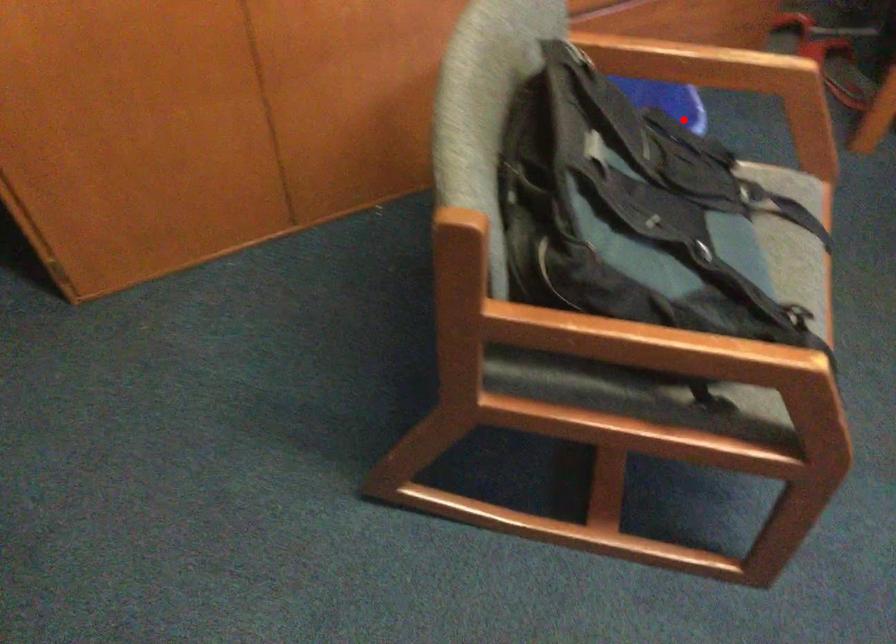
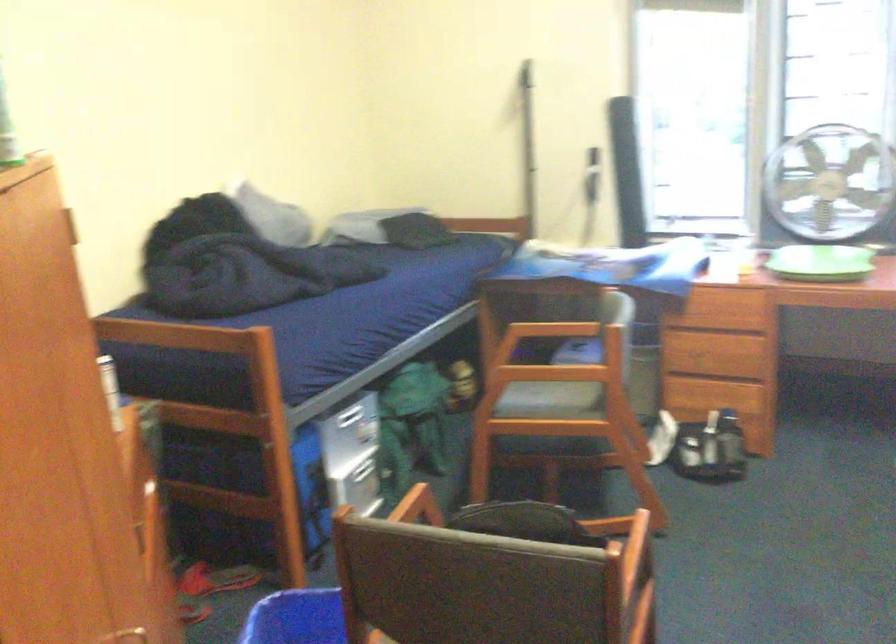
Question: I am providing you with two images of the same scene from different viewpoints. A red point is marked on the first image. At the location where the point appears in image 1, is it still visible in image 2?

Choices:
 (A) Yes
 (B) No

Answer: (A)